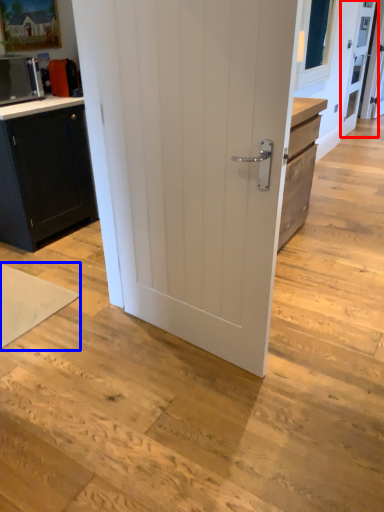
Question: Which point is further to the camera, screen door (highlighted by a red box) or yoga mat (highlighted by a blue box)?

Choices:
 (A) screen door
 (B) yoga mat

Answer: (A)